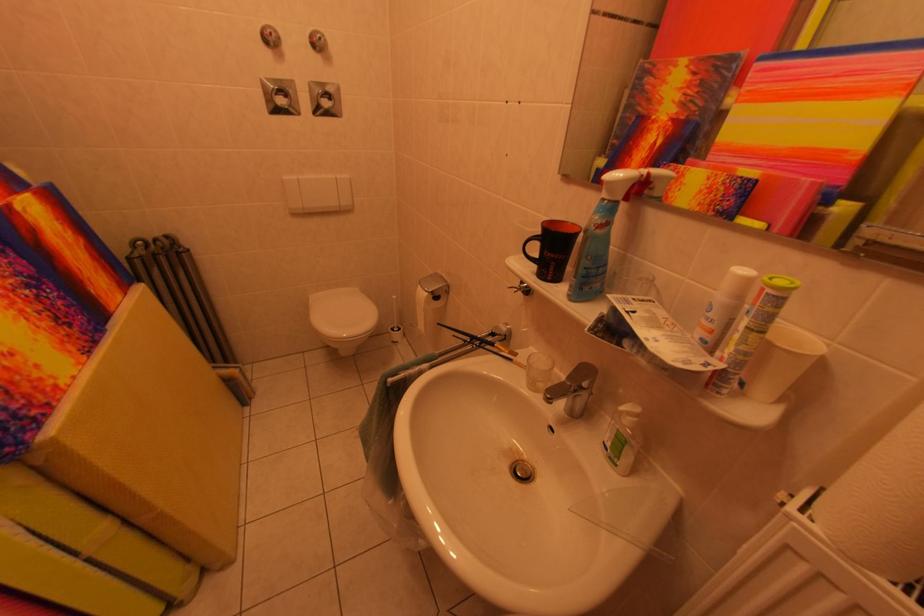
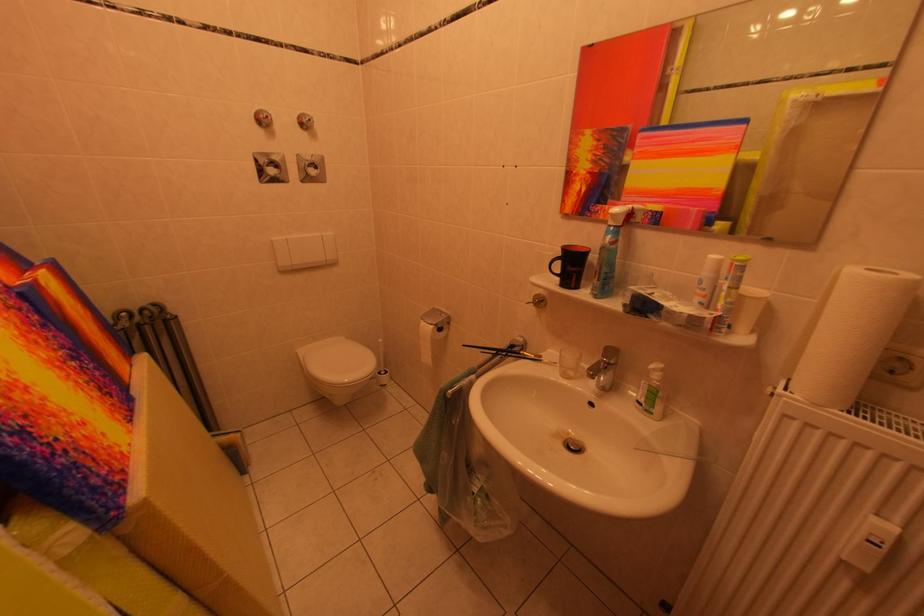
Locate, in the second image, the point that corresponds to [589,233] in the first image.

(599, 253)